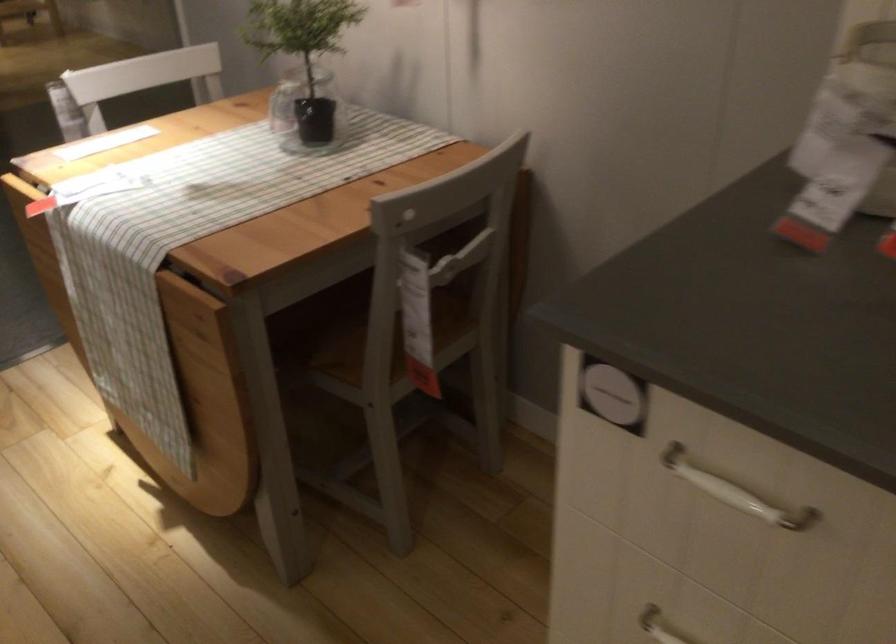
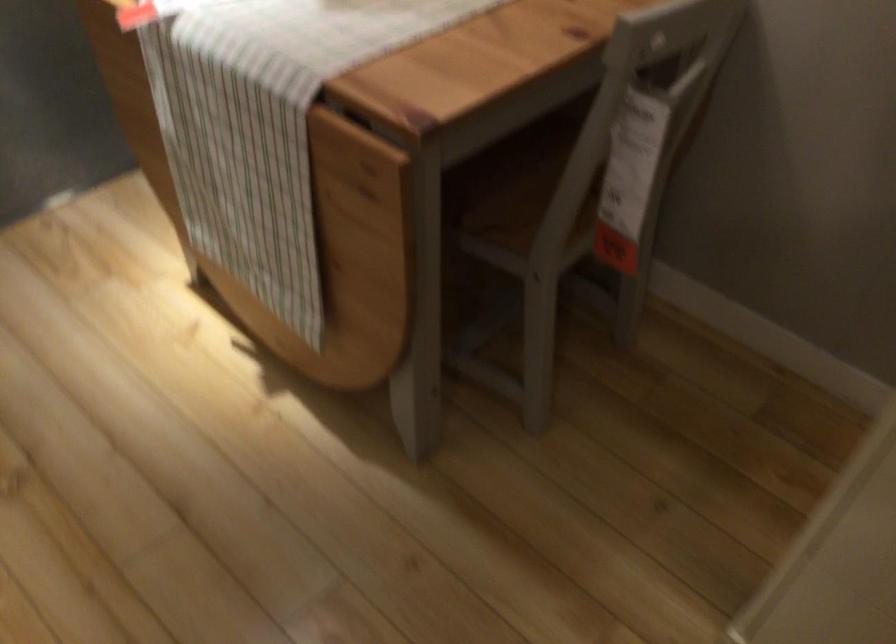
In a continuous first-person perspective shot, in which direction is the camera moving?

The movement direction of the cameraman is left, forward.